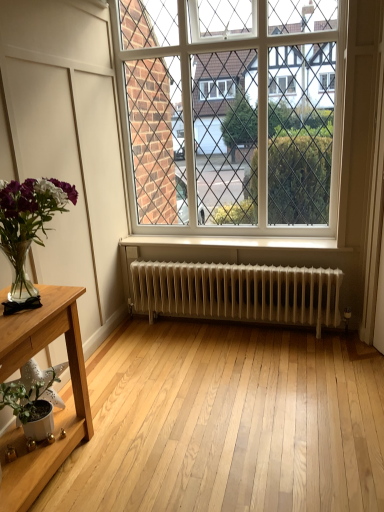
The height and width of the screenshot is (512, 384). What are the coordinates of `unoccupied area in front of white metallic radiator at center` in the screenshot? It's located at (240, 395).